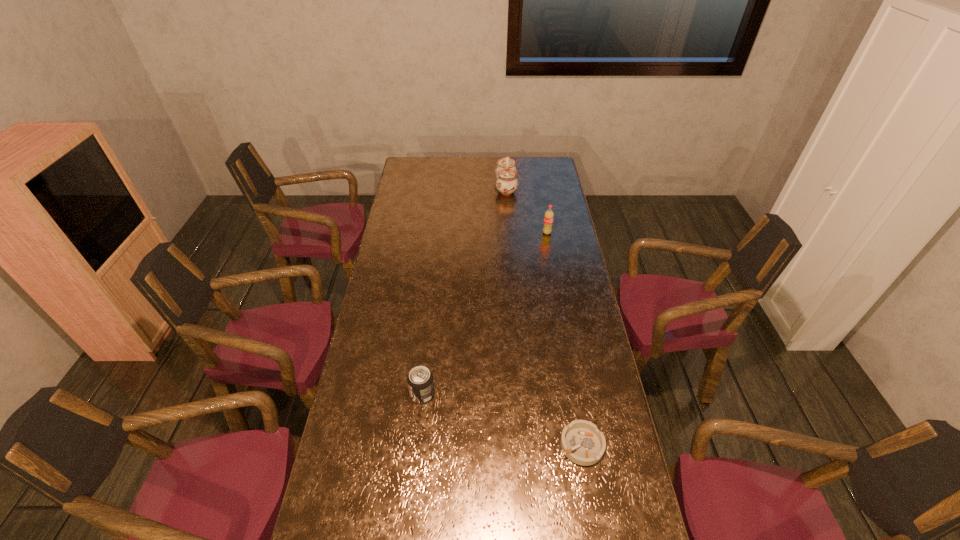
Find the location of a particular element. Image resolution: width=960 pixels, height=540 pixels. free space located by the handle of the chinaware is located at coordinates (480, 187).

You are a GUI agent. You are given a task and a screenshot of the screen. Output one action in this format:
    pyautogui.click(x=<x>, y=<y>)
    Task: Click on the vacant space located on the front of the right soda can
    The height and width of the screenshot is (540, 960).
    Given the screenshot: What is the action you would take?
    pyautogui.click(x=550, y=252)

Where is `vacant space situated on the back of the third tallest object`? Image resolution: width=960 pixels, height=540 pixels. vacant space situated on the back of the third tallest object is located at coordinates (432, 306).

You are a GUI agent. You are given a task and a screenshot of the screen. Output one action in this format:
    pyautogui.click(x=<x>, y=<y>)
    Task: Click on the blank space located 0.200m on the back of the nearest object
    The image size is (960, 540).
    Given the screenshot: What is the action you would take?
    pyautogui.click(x=569, y=369)

Identify the location of object that is at the far edge. (506, 172).

The width and height of the screenshot is (960, 540). I want to click on soda at the right edge, so click(549, 215).

Identify the location of ashtray present at the right edge. (581, 441).

The width and height of the screenshot is (960, 540). Find the location of `vacant space at the far edge`. vacant space at the far edge is located at coordinates (477, 166).

Locate an element on the screen. This screenshot has height=540, width=960. vacant space at the left edge of the desktop is located at coordinates (392, 252).

Locate an element on the screen. The width and height of the screenshot is (960, 540). vacant area at the right edge is located at coordinates (573, 466).